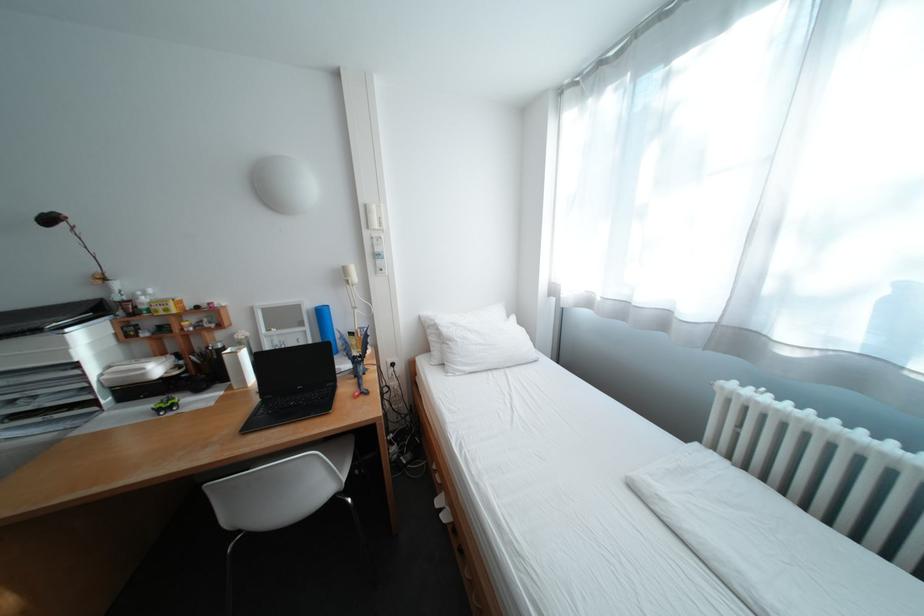
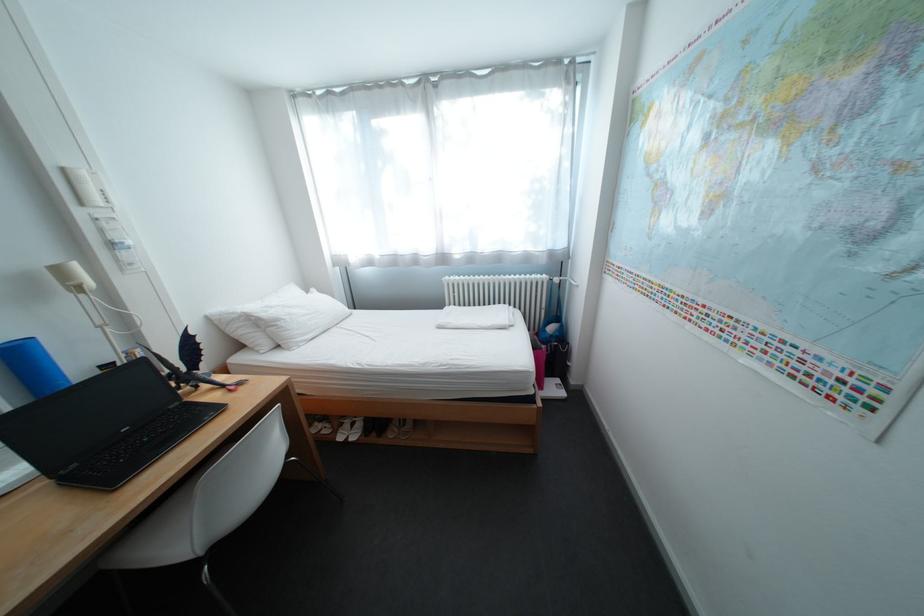
Find the pixel in the second image that matches [311,389] in the first image.

(137, 431)